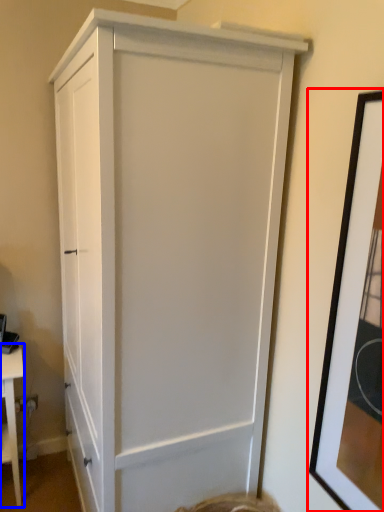
Question: Which object appears farthest to the camera in this image, picture frame (highlighted by a red box) or table (highlighted by a blue box)?

Choices:
 (A) picture frame
 (B) table

Answer: (B)